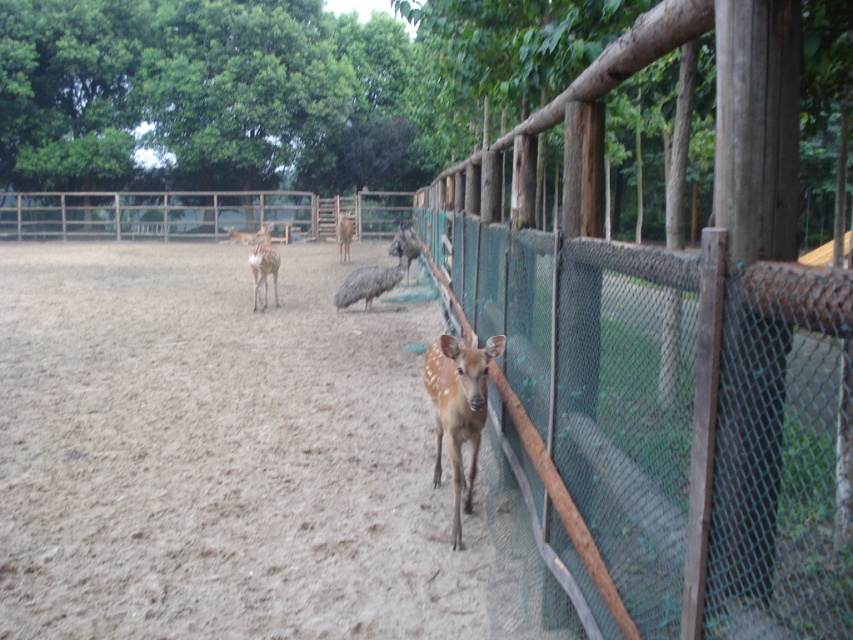
From the picture: Can you confirm if green mesh fence at center is smaller than brown glossy deer at center?

Yes, green mesh fence at center is smaller than brown glossy deer at center.

Is point (450, 298) more distant than point (263, 228)?

No.

Locate an element on the screen. Image resolution: width=853 pixels, height=640 pixels. green mesh fence at center is located at coordinates (671, 358).

Is green mesh fence at center further to the viewer compared to brown feathered bird at center?

No, it is not.

Between green mesh fence at center and brown feathered bird at center, which one has more height?

brown feathered bird at center is taller.

Describe the element at coordinates (671, 358) in the screenshot. This screenshot has height=640, width=853. I see `green mesh fence at center` at that location.

Where is `green mesh fence at center`? green mesh fence at center is located at coordinates (671, 358).

Between brown sandy dirt at center and brown feathered bird at center, which one has less height?

With less height is brown feathered bird at center.

Locate an element on the screen. brown sandy dirt at center is located at coordinates (225, 458).